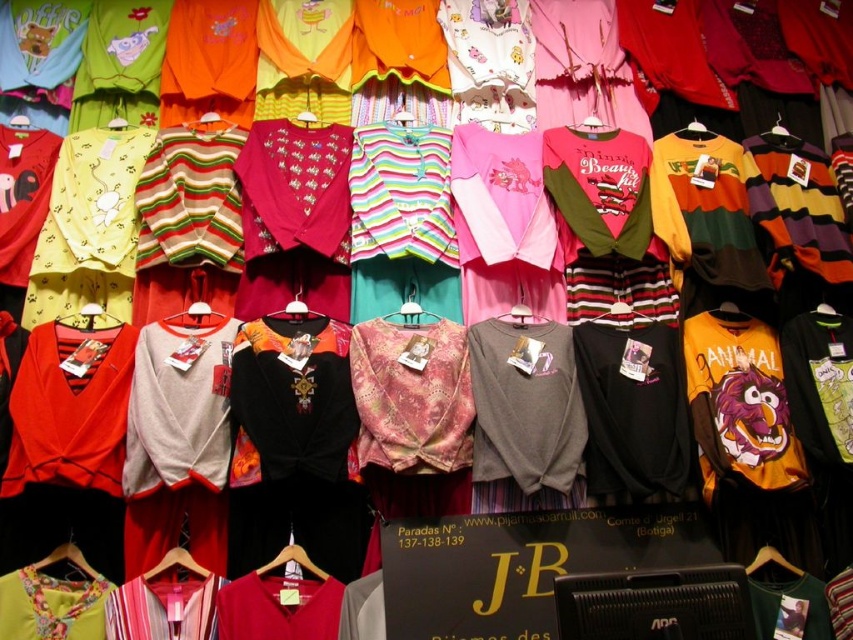
Question: Is black matte t-shirt at center to the left of multicolored striped sweater at center from the viewer's perspective?

Choices:
 (A) no
 (B) yes

Answer: (B)

Question: Based on their relative distances, which object is farther from the multicolored striped sweater at center?

Choices:
 (A) wooden hanger at lower left
 (B) matte red shirt at lower center

Answer: (A)

Question: Can you confirm if gray matte sweatshirt at center is smaller than matte fabric shirt at center?

Choices:
 (A) no
 (B) yes

Answer: (A)

Question: Which point is closer to the camera?

Choices:
 (A) (335, 602)
 (B) (590, 481)

Answer: (A)

Question: Which point is closer to the camera taking this photo?

Choices:
 (A) (584, 406)
 (B) (305, 568)

Answer: (B)

Question: Is black matte t-shirt at center wider than wooden hanger at lower left?

Choices:
 (A) yes
 (B) no

Answer: (A)